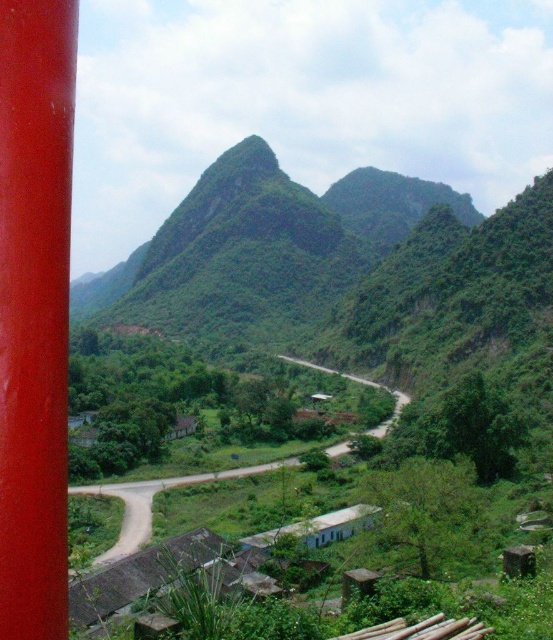
Describe the element at coordinates (34, 310) in the screenshot. I see `glossy red pole at left` at that location.

In the scene shown: Is the position of glossy red pole at left less distant than that of green grassy road at center?

Yes, it is.

What are the coordinates of `glossy red pole at left` in the screenshot? It's located at (34, 310).

At what (x,y) coordinates should I click in order to perform the action: click on glossy red pole at left. Please return your answer as a coordinate pair (x, y). This screenshot has width=553, height=640. Looking at the image, I should click on (34, 310).